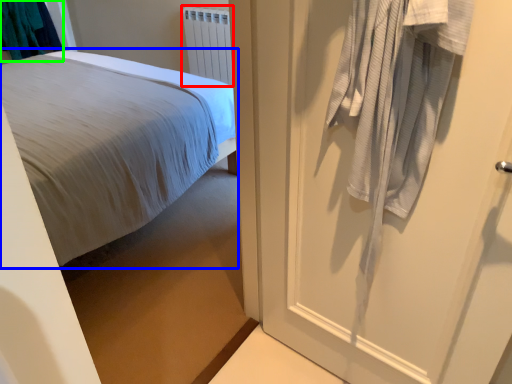
Question: Based on their relative distances, which object is nearer to radiator (highlighted by a red box)? Choose from bed (highlighted by a blue box) and laundry (highlighted by a green box).

Choices:
 (A) bed
 (B) laundry

Answer: (A)